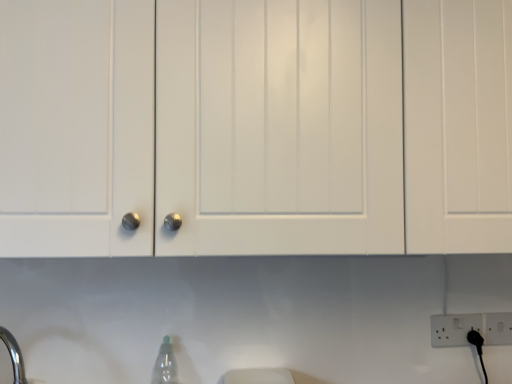
Question: Are transparent plastic bottle at lower center and white matte cabinet at center far apart?

Choices:
 (A) yes
 (B) no

Answer: (B)

Question: Does transparent plastic bottle at lower center come behind white matte cabinet at center?

Choices:
 (A) yes
 (B) no

Answer: (A)

Question: Does transparent plastic bottle at lower center have a lesser height compared to white matte cabinet at center?

Choices:
 (A) yes
 (B) no

Answer: (A)

Question: Is transparent plastic bottle at lower center touching white matte cabinet at center?

Choices:
 (A) yes
 (B) no

Answer: (B)

Question: Can you confirm if transparent plastic bottle at lower center is thinner than white matte cabinet at center?

Choices:
 (A) no
 (B) yes

Answer: (B)

Question: Based on their sizes in the image, would you say white matte cabinet at center is bigger or smaller than transparent plastic bottle at lower center?

Choices:
 (A) small
 (B) big

Answer: (B)

Question: Considering the relative positions of white matte cabinet at center and transparent plastic bottle at lower center in the image provided, is white matte cabinet at center to the left or to the right of transparent plastic bottle at lower center?

Choices:
 (A) right
 (B) left

Answer: (A)

Question: Is white matte cabinet at center in front of or behind transparent plastic bottle at lower center in the image?

Choices:
 (A) behind
 (B) front

Answer: (B)

Question: Looking at their shapes, would you say white matte cabinet at center is wider or thinner than transparent plastic bottle at lower center?

Choices:
 (A) wide
 (B) thin

Answer: (A)

Question: Is transparent plastic bottle at lower center in front of or behind white plastic electric outlet at lower right in the image?

Choices:
 (A) front
 (B) behind

Answer: (A)

Question: From the image's perspective, is transparent plastic bottle at lower center located above or below white plastic electric outlet at lower right?

Choices:
 (A) above
 (B) below

Answer: (B)

Question: Based on their sizes in the image, would you say transparent plastic bottle at lower center is bigger or smaller than white plastic electric outlet at lower right?

Choices:
 (A) small
 (B) big

Answer: (B)

Question: Would you say transparent plastic bottle at lower center is inside or outside white plastic electric outlet at lower right?

Choices:
 (A) outside
 (B) inside

Answer: (A)

Question: Considering the positions of white plastic electric outlet at lower right and transparent plastic bottle at lower center in the image, is white plastic electric outlet at lower right bigger or smaller than transparent plastic bottle at lower center?

Choices:
 (A) small
 (B) big

Answer: (A)

Question: In the image, is white plastic electric outlet at lower right on the left side or the right side of transparent plastic bottle at lower center?

Choices:
 (A) left
 (B) right

Answer: (B)